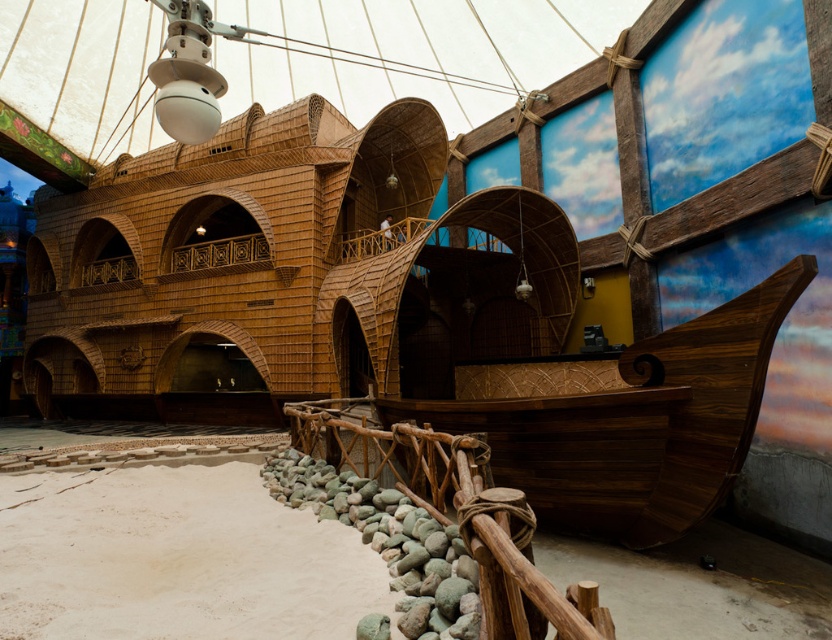
Does white fabric canopy at upper center come behind white sand at lower center?

Yes, it is behind white sand at lower center.

Does white fabric canopy at upper center have a lesser height compared to white sand at lower center?

No, white fabric canopy at upper center is not shorter than white sand at lower center.

What do you see at coordinates (414, 51) in the screenshot? I see `white fabric canopy at upper center` at bounding box center [414, 51].

Find the location of `white fabric canopy at upper center`. white fabric canopy at upper center is located at coordinates (414, 51).

Is point (60, 3) closer to camera compared to point (506, 492)?

No, it is behind (506, 492).

Who is more forward, (33, 118) or (312, 404)?

Point (312, 404) is more forward.

You are a GUI agent. You are given a task and a screenshot of the screen. Output one action in this format:
    pyautogui.click(x=<x>, y=<y>)
    Task: Click on the white fabric canopy at upper center
    
    Given the screenshot: What is the action you would take?
    pyautogui.click(x=414, y=51)

What do you see at coordinates (176, 557) in the screenshot?
I see `white sand at lower center` at bounding box center [176, 557].

Who is positioned more to the right, white sand at lower center or rustic wood rail at lower center?

Positioned to the right is rustic wood rail at lower center.

Who is more distant from viewer, [92,548] or [367,435]?

The point [367,435] is behind.

Image resolution: width=832 pixels, height=640 pixels. I want to click on white sand at lower center, so click(x=176, y=557).